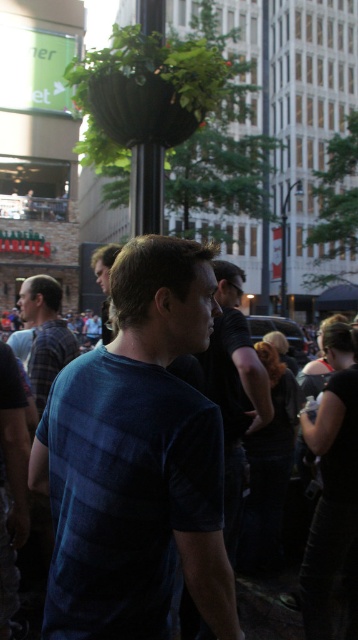
Is plaid fabric shirt at left taller than green matte pole at center?

Yes, plaid fabric shirt at left is taller than green matte pole at center.

Who is more distant from viewer, (36, 320) or (158, 202)?

The point (36, 320) is more distant.

This screenshot has width=358, height=640. I want to click on plaid fabric shirt at left, so click(x=45, y=333).

The width and height of the screenshot is (358, 640). Describe the element at coordinates (234, 390) in the screenshot. I see `dark blue shirt at center` at that location.

At what (x,y) coordinates should I click in order to perform the action: click on dark blue shirt at center. Please return your answer as a coordinate pair (x, y). The image size is (358, 640). Looking at the image, I should click on (234, 390).

Can you confirm if dark blue shirt at center is positioned to the right of plaid fabric shirt at left?

Correct, you'll find dark blue shirt at center to the right of plaid fabric shirt at left.

Can you confirm if dark blue shirt at center is bigger than plaid fabric shirt at left?

No, dark blue shirt at center is not bigger than plaid fabric shirt at left.

Identify the location of dark blue shirt at center. (234, 390).

At what (x,y) coordinates should I click in order to perform the action: click on dark blue shirt at center. Please return your answer as a coordinate pair (x, y). Looking at the image, I should click on (234, 390).